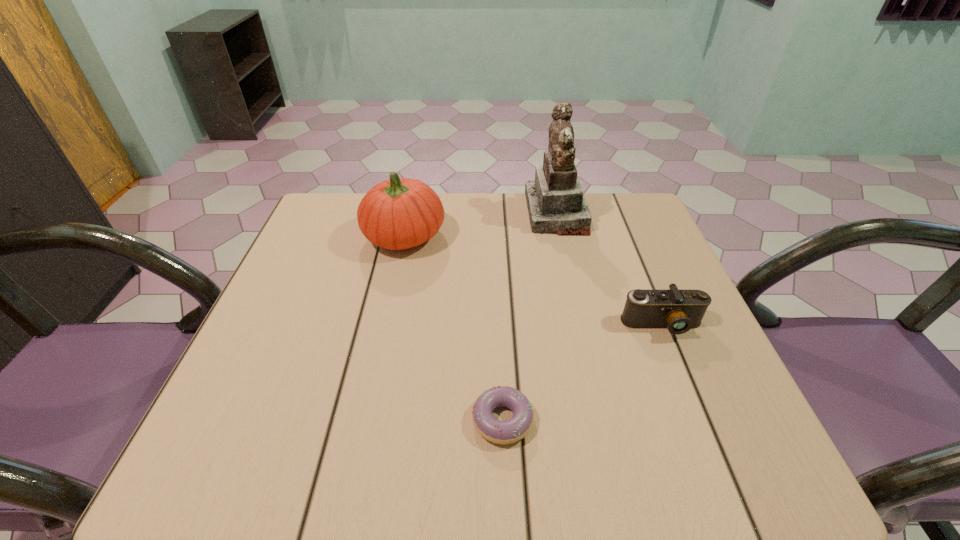
What are the coordinates of `free space between the leftmost object and the second object from left to right` in the screenshot? It's located at (453, 328).

At what (x,y) coordinates should I click in order to perform the action: click on vacant area between the shortest object and the rightmost object. Please return your answer as a coordinate pair (x, y). This screenshot has width=960, height=540. Looking at the image, I should click on (583, 372).

Locate an element on the screen. The height and width of the screenshot is (540, 960). free spot between the figurine and the shortest object is located at coordinates (529, 316).

Image resolution: width=960 pixels, height=540 pixels. Find the location of `vacant space in between the camera and the tallest object`. vacant space in between the camera and the tallest object is located at coordinates (609, 269).

The height and width of the screenshot is (540, 960). I want to click on vacant area that lies between the second object from left to right and the pumpkin, so click(x=453, y=328).

The image size is (960, 540). Find the location of `empty space between the second object from right to left and the third object from right to left`. empty space between the second object from right to left and the third object from right to left is located at coordinates (529, 316).

Select which object appears as the closest to the doughnut. Please provide its 2D coordinates. Your answer should be formatted as a tuple, i.e. [(x, y)], where the tuple contains the x and y coordinates of a point satisfying the conditions above.

[(677, 310)]

Locate an element on the screen. Image resolution: width=960 pixels, height=540 pixels. the closest object to the third object from right to left is located at coordinates (677, 310).

The height and width of the screenshot is (540, 960). I want to click on free location that satisfies the following two spatial constraints: 1. on the front-facing side of the figurine; 2. on the front side of the pumpkin, so click(x=562, y=236).

Where is `free space that satisfies the following two spatial constraints: 1. on the front side of the leftmost object; 2. on the left side of the nearest object`? free space that satisfies the following two spatial constraints: 1. on the front side of the leftmost object; 2. on the left side of the nearest object is located at coordinates (365, 420).